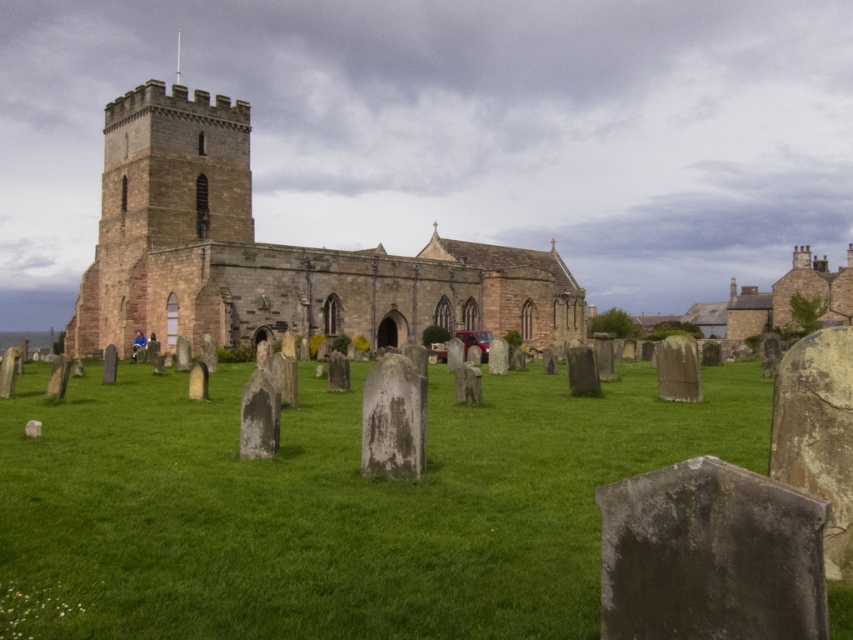
Question: Can you confirm if green grassy at center is positioned below blue fabric jacket at center?

Choices:
 (A) no
 (B) yes

Answer: (B)

Question: Which point is closer to the camera?

Choices:
 (A) blue fabric jacket at center
 (B) green grassy at center

Answer: (B)

Question: Does brown stone church at center appear under blue fabric jacket at lower left?

Choices:
 (A) yes
 (B) no

Answer: (B)

Question: Which of the following is the closest to the observer?

Choices:
 (A) (151, 349)
 (B) (143, 346)
 (C) (247, 365)

Answer: (C)

Question: Estimate the real-world distances between objects in this image. Which object is farther from the brown stone church at center?

Choices:
 (A) green grassy at center
 (B) blue fabric jacket at center

Answer: (A)

Question: Can you confirm if brown stone church at center is positioned above blue fabric jacket at center?

Choices:
 (A) yes
 (B) no

Answer: (A)